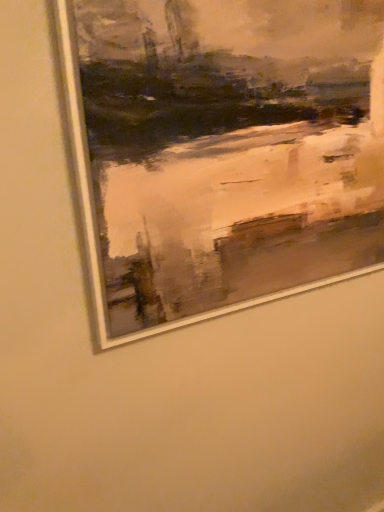
Find the location of a particular element. The width and height of the screenshot is (384, 512). white matte picture frame at upper center is located at coordinates (223, 152).

What do you see at coordinates (223, 152) in the screenshot? This screenshot has height=512, width=384. I see `white matte picture frame at upper center` at bounding box center [223, 152].

This screenshot has height=512, width=384. Identify the location of white matte picture frame at upper center. (223, 152).